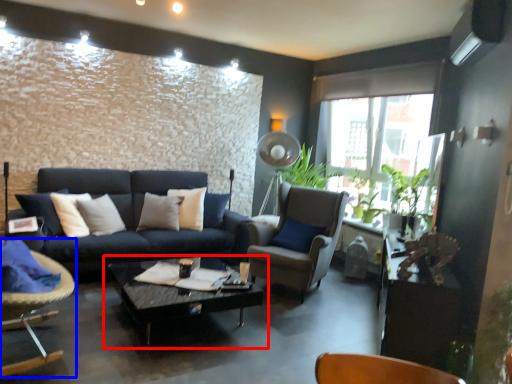
Question: Which of the following is the farthest to the observer, coffee table (highlighted by a red box) or chair (highlighted by a blue box)?

Choices:
 (A) coffee table
 (B) chair

Answer: (A)